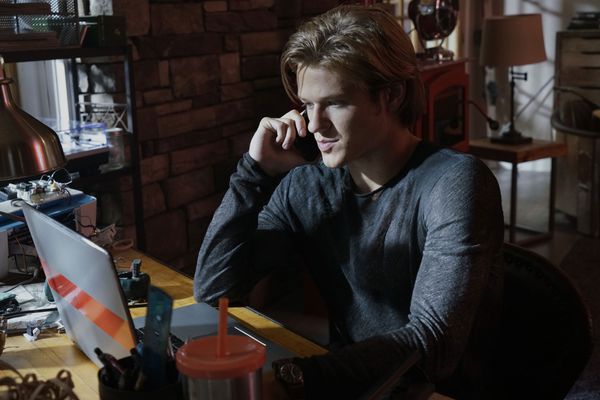
Find the location of a particular element. The image size is (600, 400). desk is located at coordinates (175, 280).